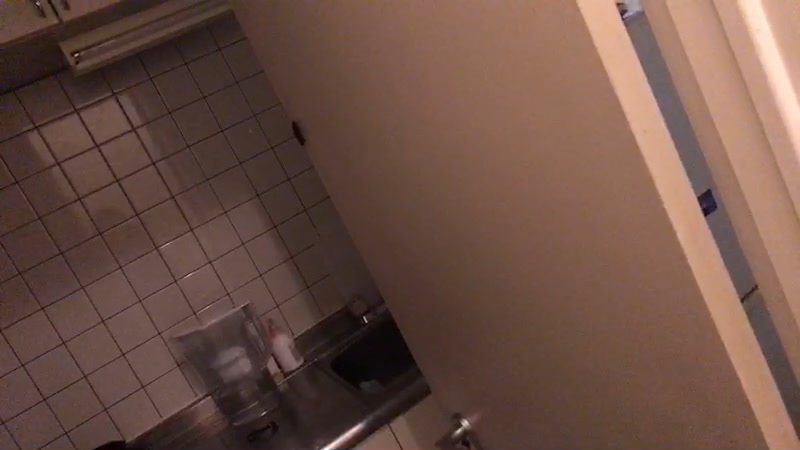
You are a GUI agent. You are given a task and a screenshot of the screen. Output one action in this format:
    pyautogui.click(x=<x>, y=<y>)
    Task: Click on the faucet
    Image resolution: width=800 pixels, height=450 pixels.
    Given the screenshot: What is the action you would take?
    pyautogui.click(x=368, y=310)